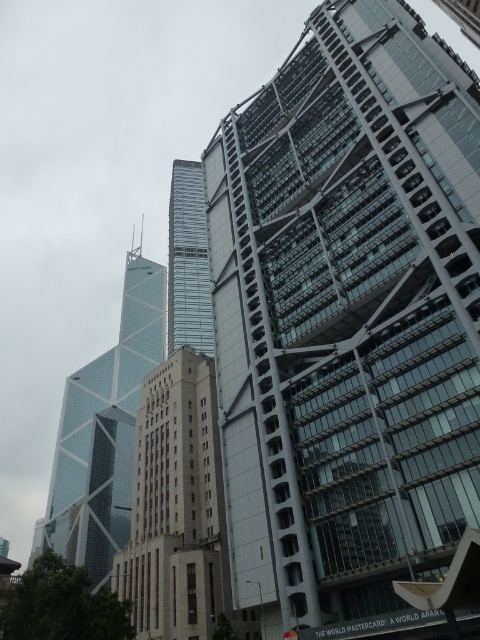
Question: Which of the following is the farthest from the observer?

Choices:
 (A) (135, 467)
 (B) (177, 244)

Answer: (B)

Question: Which object is closer to the camera taking this photo?

Choices:
 (A) glassy steel skyscraper at upper right
 (B) glassy steel tower at center
 (C) glassy blue skyscraper at left
 (D) beige concrete building at center

Answer: (A)

Question: Is beige concrete building at center behind glassy blue skyscraper at left?

Choices:
 (A) yes
 (B) no

Answer: (B)

Question: Among these points, which one is farthest from the camera?

Choices:
 (A) (419, 205)
 (B) (199, 381)
 (C) (105, 513)

Answer: (C)

Question: Does beige concrete building at center appear on the left side of glassy steel tower at center?

Choices:
 (A) yes
 (B) no

Answer: (B)

Question: Can you confirm if glassy steel skyscraper at upper right is thinner than glassy blue skyscraper at left?

Choices:
 (A) no
 (B) yes

Answer: (B)